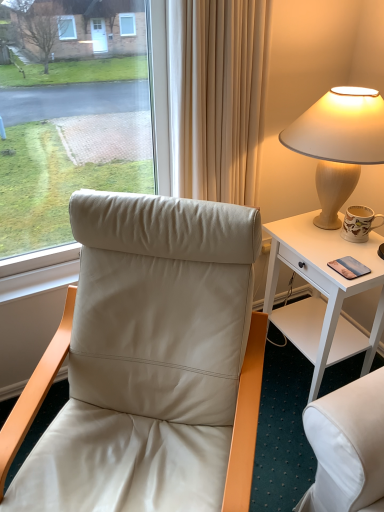
Image resolution: width=384 pixels, height=512 pixels. What do you see at coordinates (349, 267) in the screenshot?
I see `metallic silver phone at right` at bounding box center [349, 267].

The image size is (384, 512). Identify the location of leather at left. (150, 362).

Is white wood desk at right beside matte beige lamp at upper right?

white wood desk at right and matte beige lamp at upper right are not in contact.

Is white wood desk at right in front of or behind matte beige lamp at upper right in the image?

white wood desk at right is positioned farther from the viewer than matte beige lamp at upper right.

This screenshot has width=384, height=512. Identify the location of lamp to the right of white wood desk at right. (339, 144).

From the image's perspective, is metallic silver phone at right above or below matte beige lamp at upper right?

Clearly, from the image's perspective, metallic silver phone at right is below matte beige lamp at upper right.

Looking at this image, can you see metallic silver phone at right touching matte beige lamp at upper right?

metallic silver phone at right is not next to matte beige lamp at upper right, and they're not touching.

Is metallic silver phone at right situated inside matte beige lamp at upper right or outside?

The correct answer is: outside.

Does metallic silver phone at right appear on the left side of matte beige lamp at upper right?

Yes.

Is matte beige lamp at upper right to the left of leather at left from the viewer's perspective?

No, matte beige lamp at upper right is not to the left of leather at left.

Could you tell me if matte beige lamp at upper right is facing leather at left?

Yes, matte beige lamp at upper right is facing leather at left.

Does point (368, 130) lie behind point (243, 479)?

Yes, it is behind point (243, 479).

From the image's perspective, is matte ceramic mug at right located beneath leather at left?

No.

Measure the distance from matte ceramic mug at right to leather at left.

matte ceramic mug at right is 32.83 inches away from leather at left.

Is matte ceramic mug at right facing towards leather at left?

Yes.

In terms of size, does matte ceramic mug at right appear bigger or smaller than leather at left?

Clearly, matte ceramic mug at right is smaller in size than leather at left.

Is matte beige lamp at upper right positioned with its back to matte ceramic mug at right?

No, matte ceramic mug at right is not at the back of matte beige lamp at upper right.

From a real-world perspective, is matte beige lamp at upper right physically above matte ceramic mug at right?

Correct, in the physical world, matte beige lamp at upper right is higher than matte ceramic mug at right.

Does matte beige lamp at upper right have a lesser height compared to matte ceramic mug at right?

No.

From the image's perspective, between matte beige lamp at upper right and matte ceramic mug at right, who is located below?

matte ceramic mug at right.

Considering the relative sizes of leather at left and metallic silver phone at right in the image provided, is leather at left smaller than metallic silver phone at right?

Incorrect, leather at left is not smaller in size than metallic silver phone at right.

From a real-world perspective, which object rests below the other?

leather at left.

How distant is leather at left from metallic silver phone at right?

leather at left and metallic silver phone at right are 69.81 centimeters apart from each other.

Which of these two, white wood desk at right or leather at left, is wider?

Wider between the two is leather at left.

From the image's perspective, which object appears higher, white wood desk at right or leather at left?

white wood desk at right appears higher in the image.

Would you say white wood desk at right is inside or outside leather at left?

white wood desk at right is located beyond the bounds of leather at left.

Between white wood desk at right and leather at left, which one appears on the right side from the viewer's perspective?

From the viewer's perspective, white wood desk at right appears more on the right side.

This screenshot has height=512, width=384. Find the location of `lamp above the white wood desk at right (from the image's perspective)`. lamp above the white wood desk at right (from the image's perspective) is located at coordinates (339, 144).

You are a GUI agent. You are given a task and a screenshot of the screen. Output one action in this format:
    pyautogui.click(x=<x>, y=<y>)
    Task: Click on the mobile phone behind the matte beige lamp at upper right
    Image resolution: width=384 pixels, height=512 pixels.
    Given the screenshot: What is the action you would take?
    pyautogui.click(x=349, y=267)

When comparing their distances from leather at left, does metallic silver phone at right or matte beige lamp at upper right seem closer?

metallic silver phone at right is positioned closer to the anchor leather at left.

Based on their spatial positions, is matte ceramic mug at right or matte beige lamp at upper right further from leather at left?

The object further to leather at left is matte ceramic mug at right.

Based on their spatial positions, is leather at left or white wood desk at right further from metallic silver phone at right?

leather at left.

Considering their positions, is metallic silver phone at right positioned further to leather at left than matte ceramic mug at right?

The object further to leather at left is matte ceramic mug at right.

Estimate the real-world distances between objects in this image. Which object is further from matte beige lamp at upper right, matte ceramic mug at right or metallic silver phone at right?

metallic silver phone at right lies further to matte beige lamp at upper right than the other object.

When comparing their distances from matte ceramic mug at right, does leather at left or white wood desk at right seem closer?

white wood desk at right lies closer to matte ceramic mug at right than the other object.

From the picture: Based on their spatial positions, is matte ceramic mug at right or matte beige lamp at upper right further from white wood desk at right?

The object further to white wood desk at right is matte beige lamp at upper right.

Looking at the image, which one is located further to matte beige lamp at upper right, white wood desk at right or metallic silver phone at right?

The object further to matte beige lamp at upper right is metallic silver phone at right.

At what (x,y) coordinates should I click in order to perform the action: click on coffee cup that lies between matte beige lamp at upper right and white wood desk at right from top to bottom. Please return your answer as a coordinate pair (x, y). The width and height of the screenshot is (384, 512). Looking at the image, I should click on (359, 223).

Locate an element on the screen. desk between leather at left and matte ceramic mug at right in the front-back direction is located at coordinates (322, 292).

Where is `coffee cup that lies between matte beige lamp at upper right and metallic silver phone at right from top to bottom`? This screenshot has width=384, height=512. coffee cup that lies between matte beige lamp at upper right and metallic silver phone at right from top to bottom is located at coordinates (359, 223).

In order to click on mobile phone between matte ceramic mug at right and white wood desk at right from top to bottom in this screenshot , I will do `click(349, 267)`.